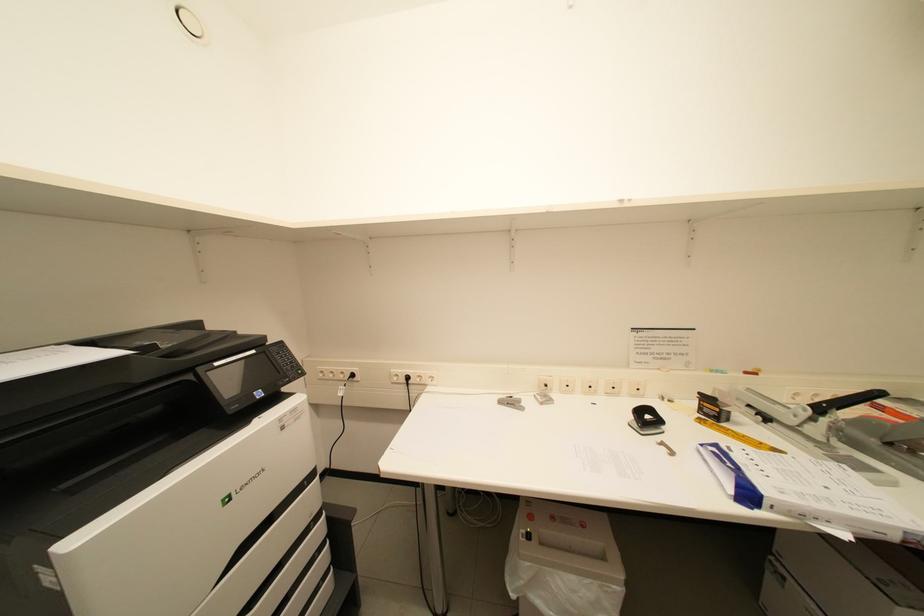
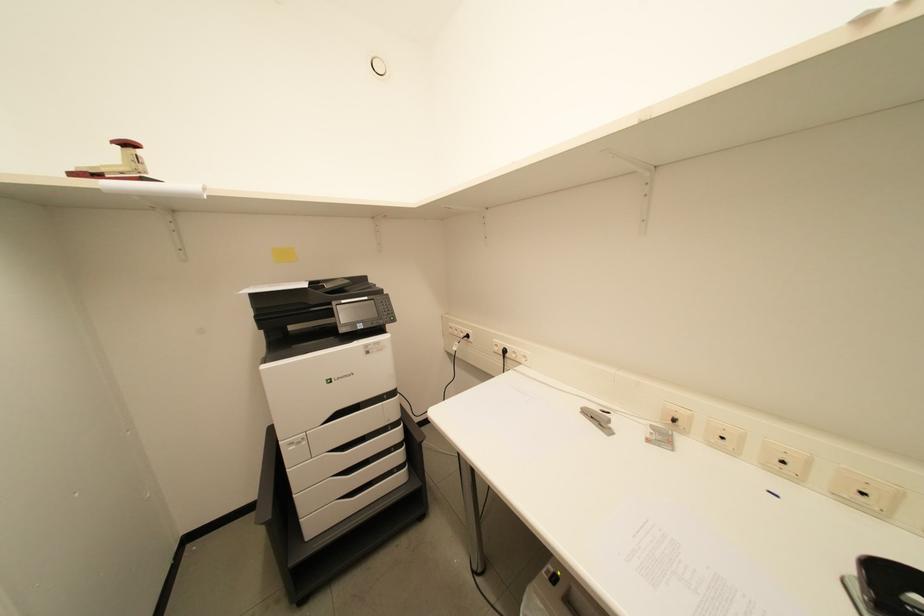
Question: How did the camera likely rotate?

Choices:
 (A) Left
 (B) Right
 (C) Up
 (D) Down

Answer: (A)